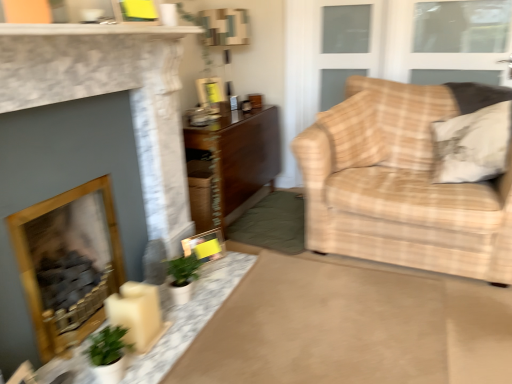
Identify the location of empty space that is to the right of yellow paper picture frame at center, the first picture frame from the front. This screenshot has width=512, height=384. (229, 259).